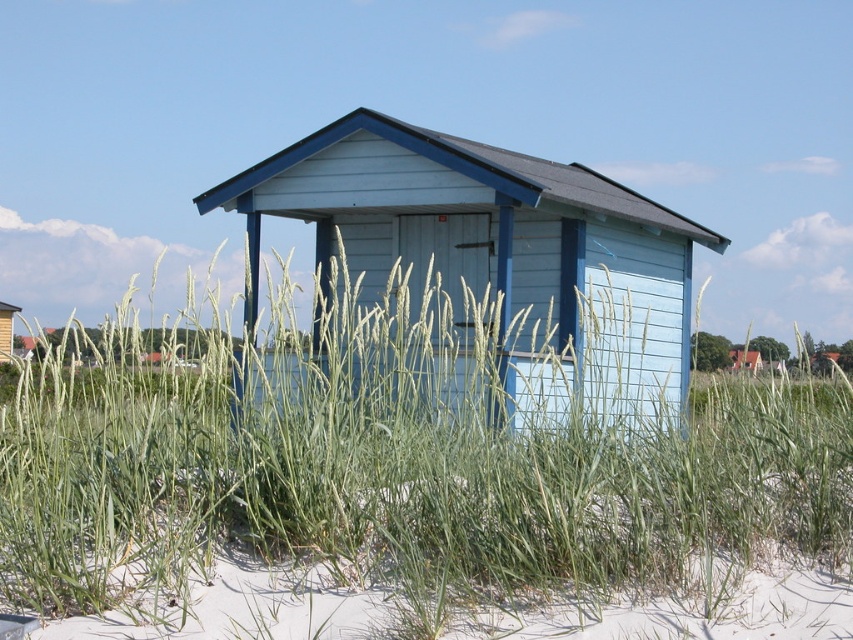
You are planning to build a new structure that needs to be shorter than the existing buildings. Based on the scene, which of the two existing structures, the light blue wood cabin at center or the matte blue wooden hut at center, should you use as a reference for height?

The matte blue wooden hut at center is shorter than the light blue wood cabin at center, so you should use the matte blue wooden hut at center as a reference for building a shorter structure.

You are standing at point A located at coordinates point A at (656, 269). You want to walk to the shed. Which direction should you go to reach the shed?

The shed is located 13.73 meters away from point A at (656, 269). To reach the shed, you should walk in the direction towards the shed from point A at (656, 269).

You are standing 10 feet away from the shed. If you walk straight towards the shed, will the green grass at center come into your path before reaching the shed?

The distance of green grass at center from viewer is 14.68 feet. Since you are currently 10 feet away from the shed, the shed is closer to you than the green grass at center. Therefore, you will reach the shed before the green grass at center comes into your path.